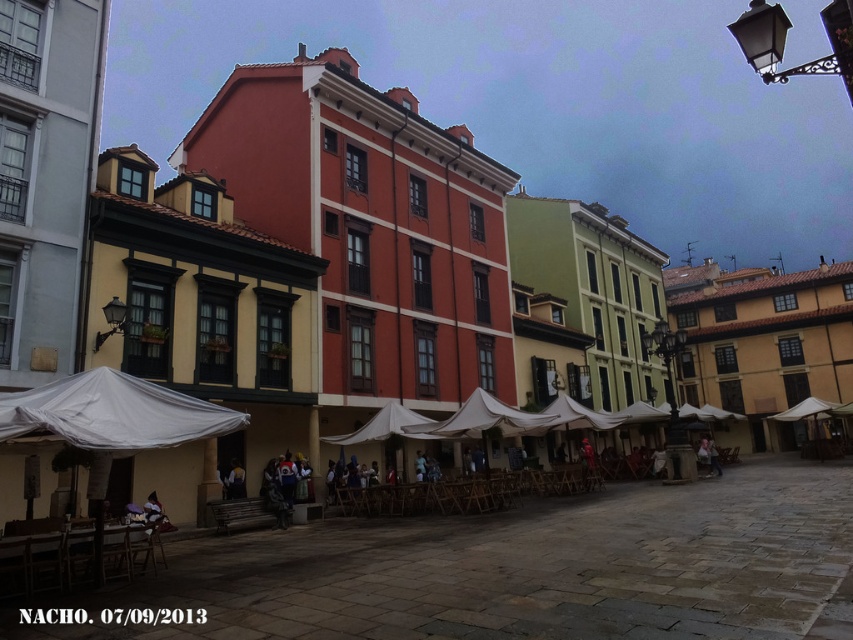
You are a tourist visiting the European town square and see the white fabric canopy at lower left and the leather jacket at center. Which object is located above the other?

The white fabric canopy at lower left is positioned over the leather jacket at center, so it is located above the leather jacket at center.